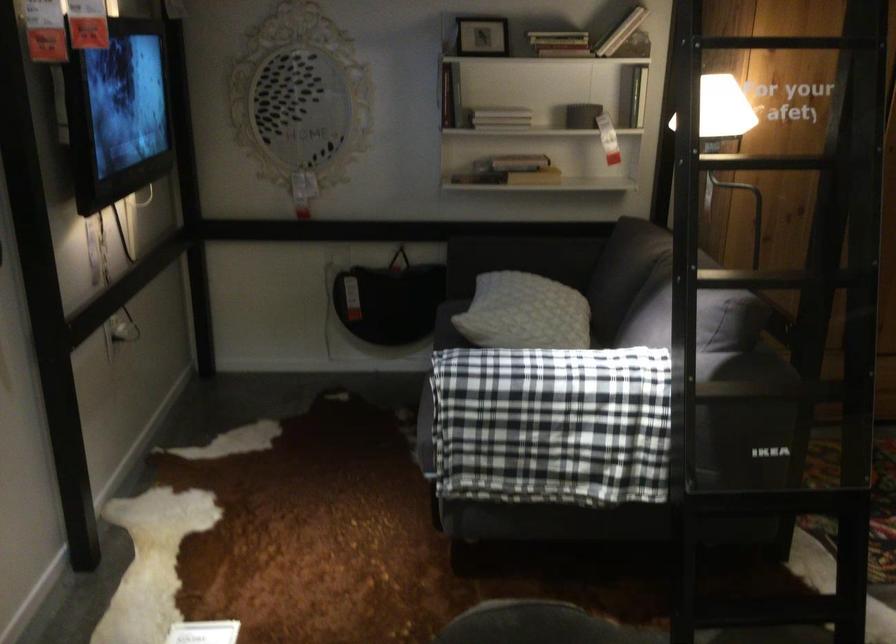
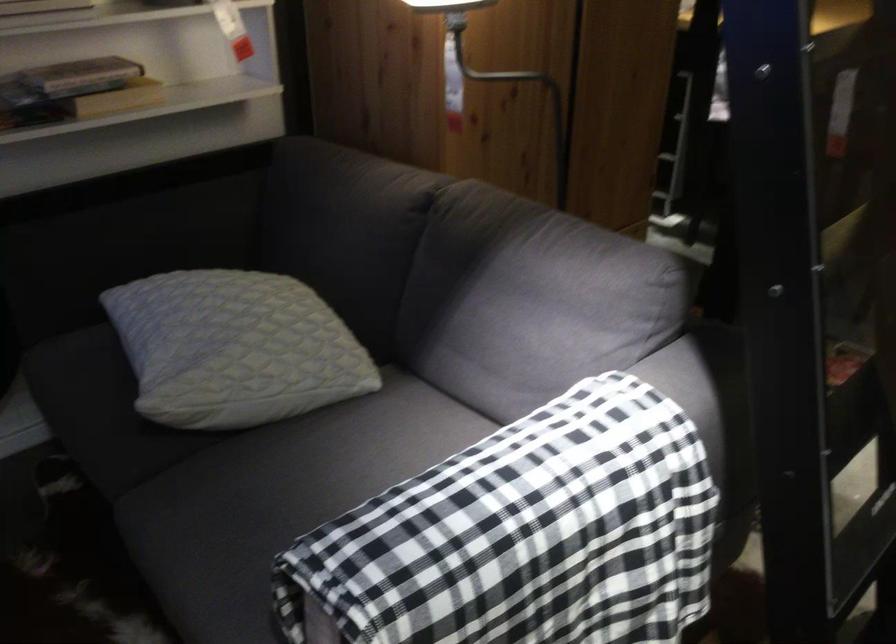
Find the pixel in the second image that matches [514,305] in the first image.

(234, 348)